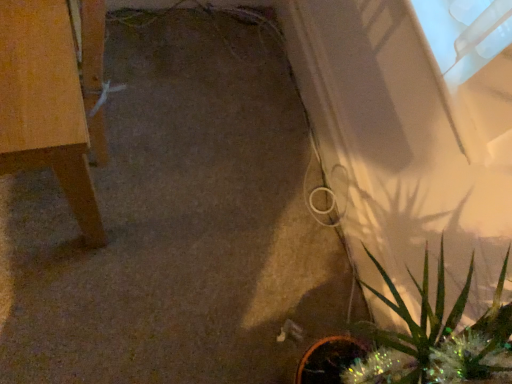
Question: Should I look upward or downward to see light brown wood table at left?

Choices:
 (A) up
 (B) down

Answer: (A)